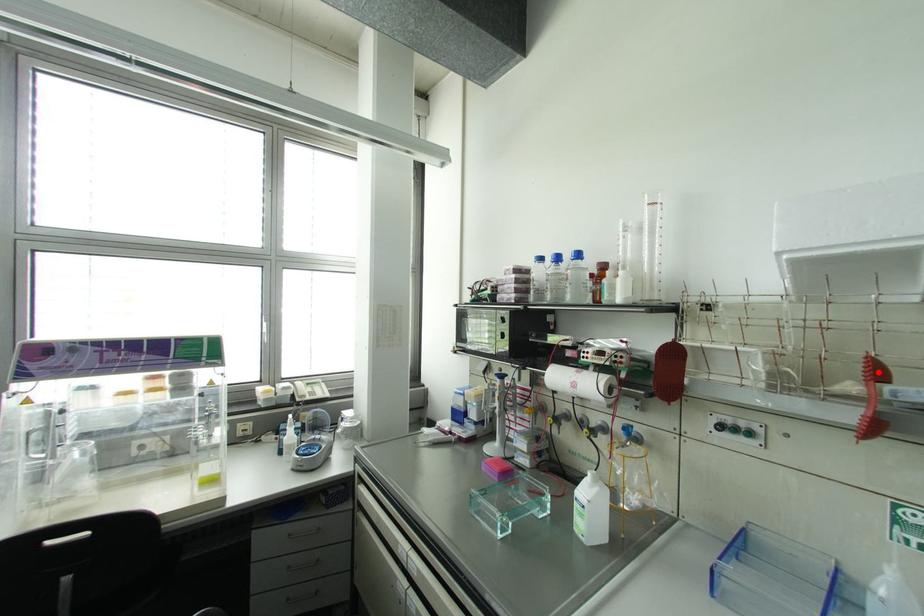
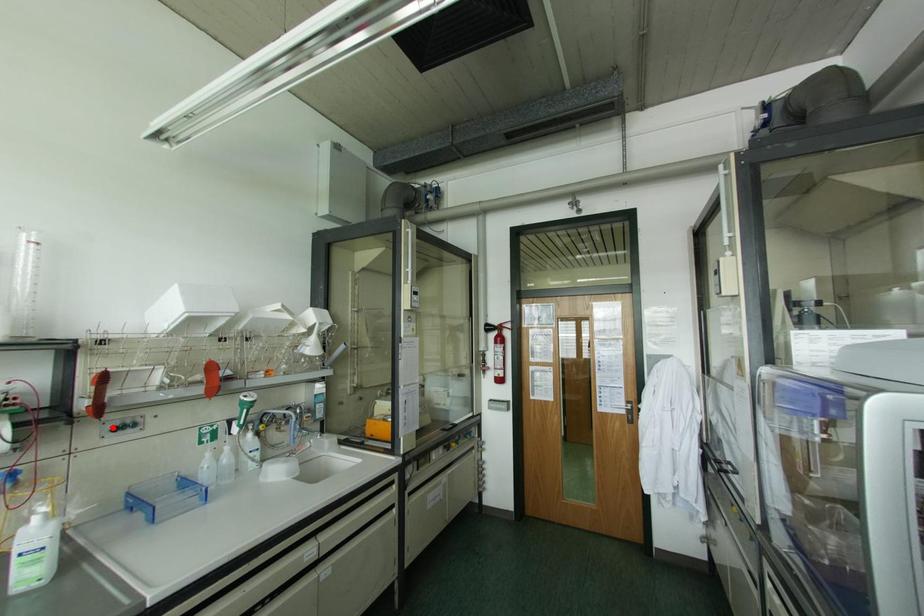
I am providing you with two images of the same scene from different viewpoints. A red point is marked on the first image and another point is marked on the second image. Does the point marked in image1 correspond to the same location as the one in image2?

No